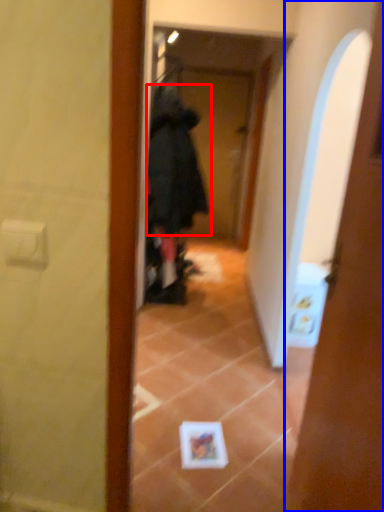
Question: Which of the following is the closest to the observer, bathrobe (highlighted by a red box) or door (highlighted by a blue box)?

Choices:
 (A) bathrobe
 (B) door

Answer: (B)